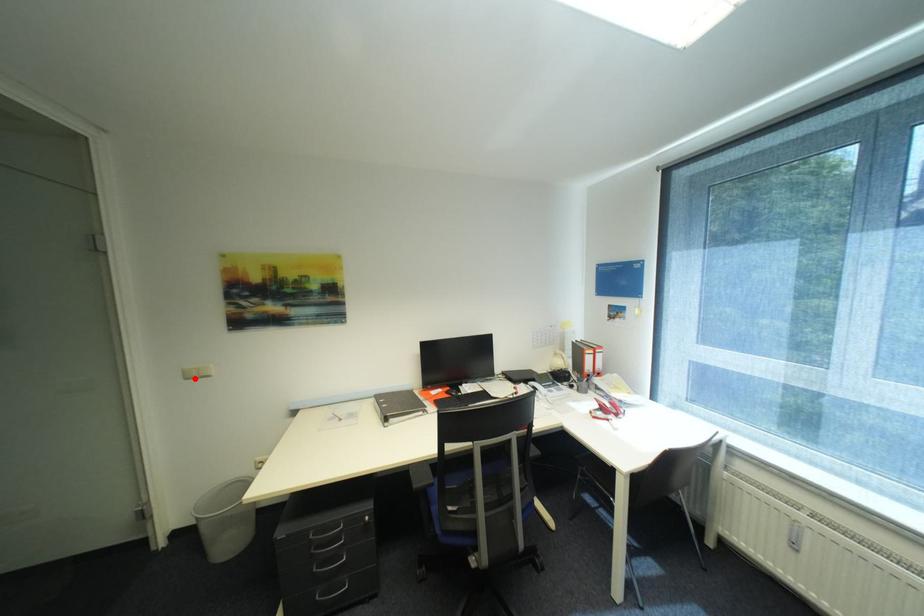
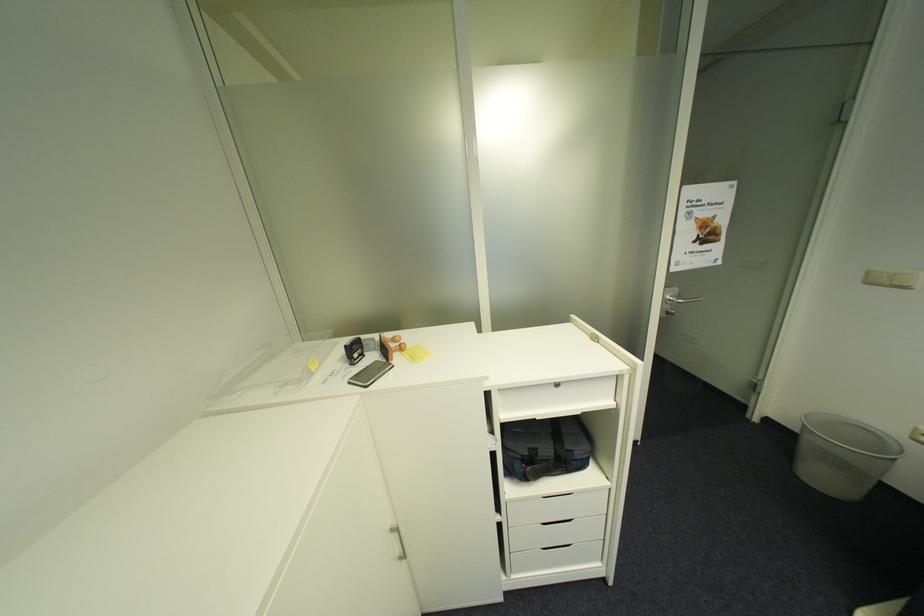
Where in the second image is the point corresponding to the highlighted location from the first image?

(876, 284)